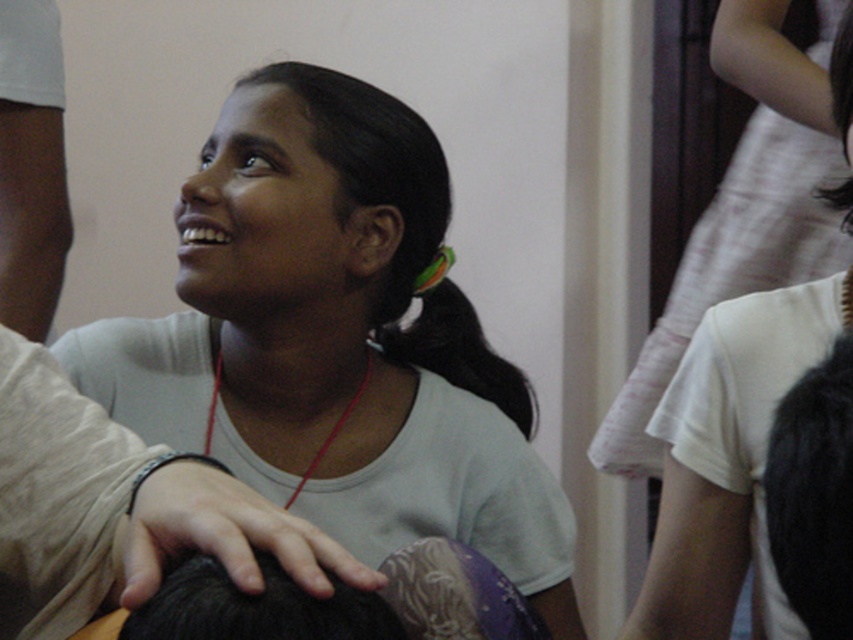
Question: Which point appears closest to the camera in this image?

Choices:
 (A) (392, 324)
 (B) (840, 93)
 (C) (811, 573)

Answer: (C)

Question: Can you confirm if white matte shirt at center is positioned to the right of black silky hair at upper right?

Choices:
 (A) yes
 (B) no

Answer: (B)

Question: Which point appears farthest from the camera in this image?

Choices:
 (A) (679, 404)
 (B) (784, 580)

Answer: (A)

Question: Can you confirm if matte skin arm at left is positioned below black silky hair at upper right?

Choices:
 (A) yes
 (B) no

Answer: (B)

Question: Which point is closer to the camera taking this photo?

Choices:
 (A) (706, 352)
 (B) (26, 272)
 (C) (265, 616)

Answer: (C)

Question: Is matte skin arm at left smaller than black silky hair at upper right?

Choices:
 (A) no
 (B) yes

Answer: (B)